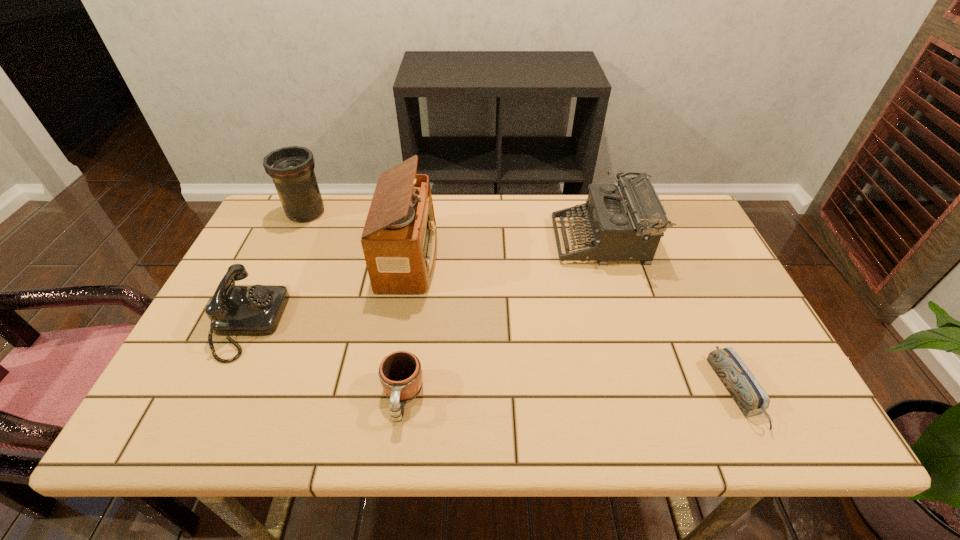
The height and width of the screenshot is (540, 960). I want to click on free space between the shortest object and the telephone, so click(492, 358).

Locate an element on the screen. empty location between the second shortest object and the telephone is located at coordinates (325, 361).

Identify the location of free space between the telephoto lens and the typewriter. This screenshot has height=540, width=960. (454, 227).

I want to click on vacant region between the fourth tallest object and the telephoto lens, so click(277, 268).

Find the location of a particular element. The height and width of the screenshot is (540, 960). free space that is in between the fifth tallest object and the tallest object is located at coordinates (406, 328).

Image resolution: width=960 pixels, height=540 pixels. In order to click on free space between the fifth object from left to right and the fifth tallest object in this screenshot , I will do `click(502, 320)`.

At what (x,y) coordinates should I click in order to perform the action: click on vacant area that lies between the radio receiver and the second object from right to left. Please return your answer as a coordinate pair (x, y). Looking at the image, I should click on (506, 249).

This screenshot has height=540, width=960. I want to click on free point between the telephoto lens and the shortest object, so click(521, 302).

This screenshot has height=540, width=960. Find the location of `the second closest object to the typewriter`. the second closest object to the typewriter is located at coordinates (399, 240).

The image size is (960, 540). I want to click on object that is the closest to the third shortest object, so click(399, 240).